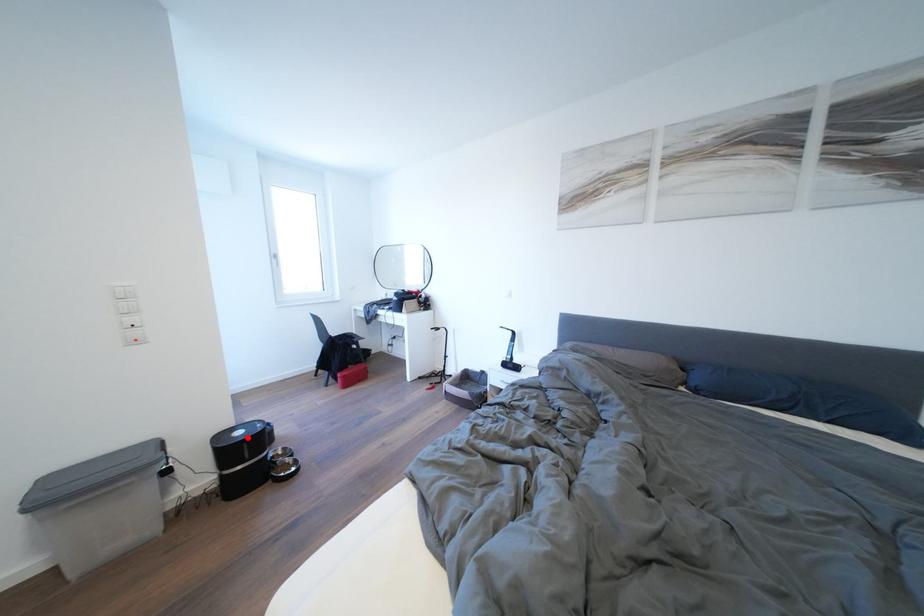
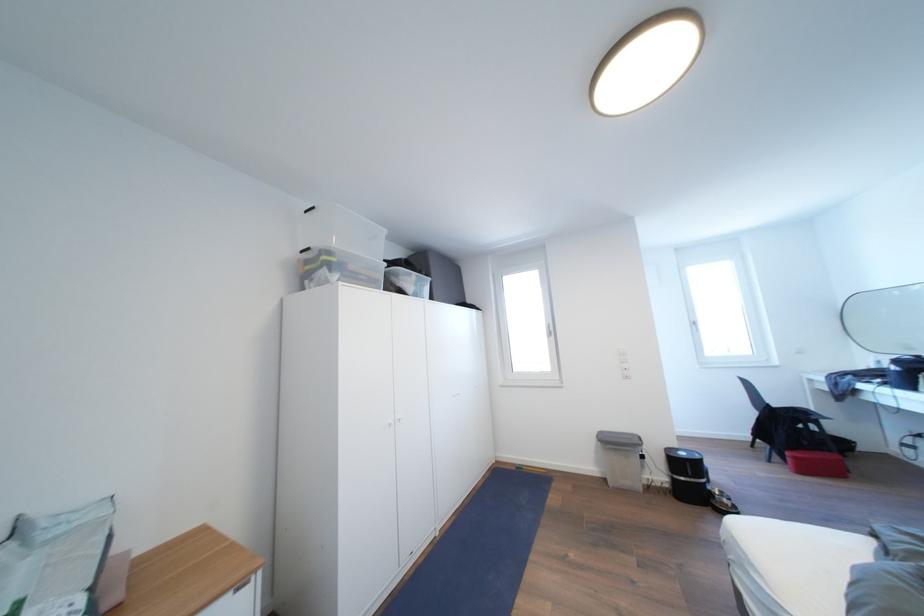
Question: I am providing you with two images of the same scene from different viewpoints. Given a red point in image1, look at the same physical point in image2. Is it:

Choices:
 (A) Closer to the viewpoint
 (B) Farther from the viewpoint

Answer: (B)